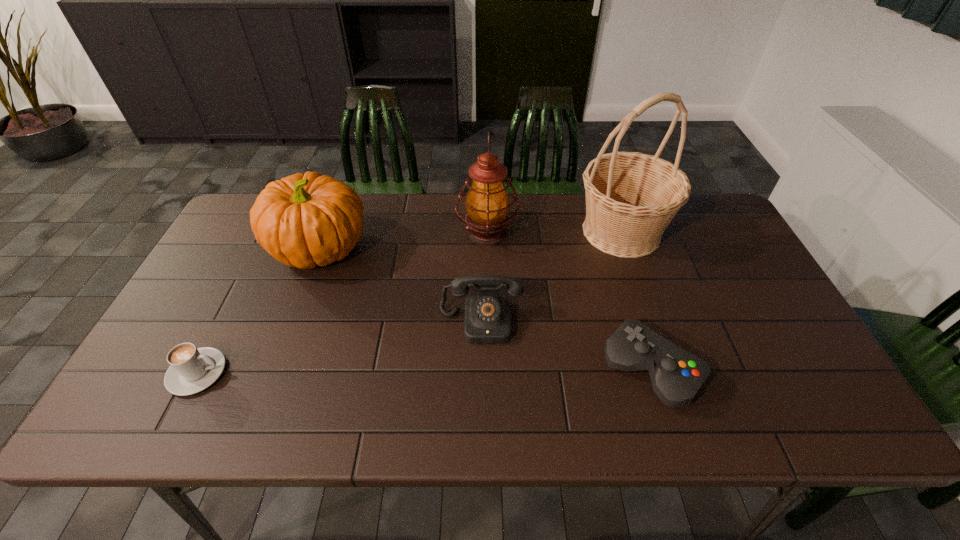
Find the location of a particular element. vacant space situated on the left of the control is located at coordinates (467, 369).

Locate an element on the screen. vacant space situated to the right of the cappuccino is located at coordinates (354, 373).

Find the location of a particular element. The height and width of the screenshot is (540, 960). basket situated at the far edge is located at coordinates (631, 197).

Image resolution: width=960 pixels, height=540 pixels. What are the coordinates of `oil lamp at the far edge` in the screenshot? It's located at (x=487, y=203).

Image resolution: width=960 pixels, height=540 pixels. In order to click on pumpkin positioned at the far edge in this screenshot , I will do `click(304, 220)`.

Find the location of a particular element. The width and height of the screenshot is (960, 540). control at the near edge is located at coordinates (676, 375).

The height and width of the screenshot is (540, 960). I want to click on cappuccino that is positioned at the near edge, so click(x=192, y=369).

Locate an element on the screen. The width and height of the screenshot is (960, 540). pumpkin that is at the left edge is located at coordinates (304, 220).

This screenshot has width=960, height=540. I want to click on cappuccino at the left edge, so click(192, 369).

Identify the location of object at the far left corner. [304, 220].